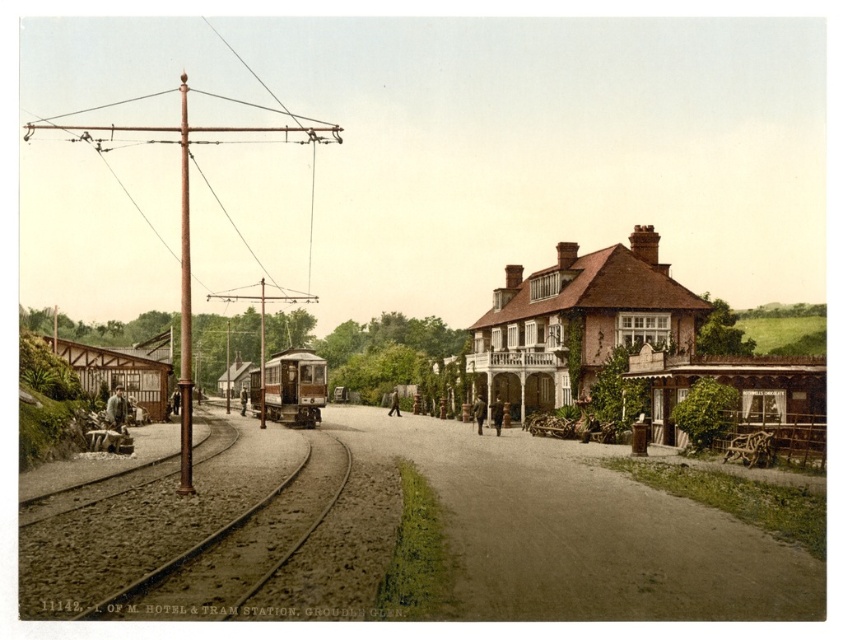
Based on the scene at Groudle Glen tram station, can you determine if the brown gravel road at center is wider than the polished brass tram at center?

The brown gravel road at center is wider than the polished brass tram at center according to the description.

You are standing at the Groudle Glen tram station and see the brown gravel track at lower left and the wooden coach at left. Which object is lower in height?

The brown gravel track at lower left has a lesser height compared to the wooden coach at left, so the brown gravel track at lower left is lower in height.

You are a visitor arriving at the Groudle Glen tram station and hotel. You see the brown gravel road at center and the polished brass tram at center. Which one appears larger in the image?

The polished brass tram at center appears larger than the brown gravel road at center in the image.